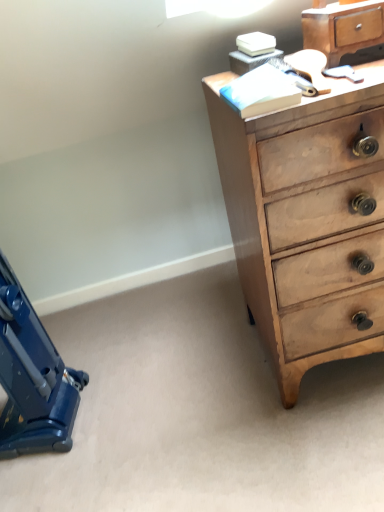
Find the location of a particular element. The image size is (384, 512). free spot to the right of blue plastic vacuum cleaner at lower left is located at coordinates (128, 401).